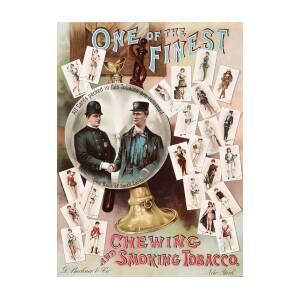
Where is `gramaphone`? gramaphone is located at coordinates (143, 215).